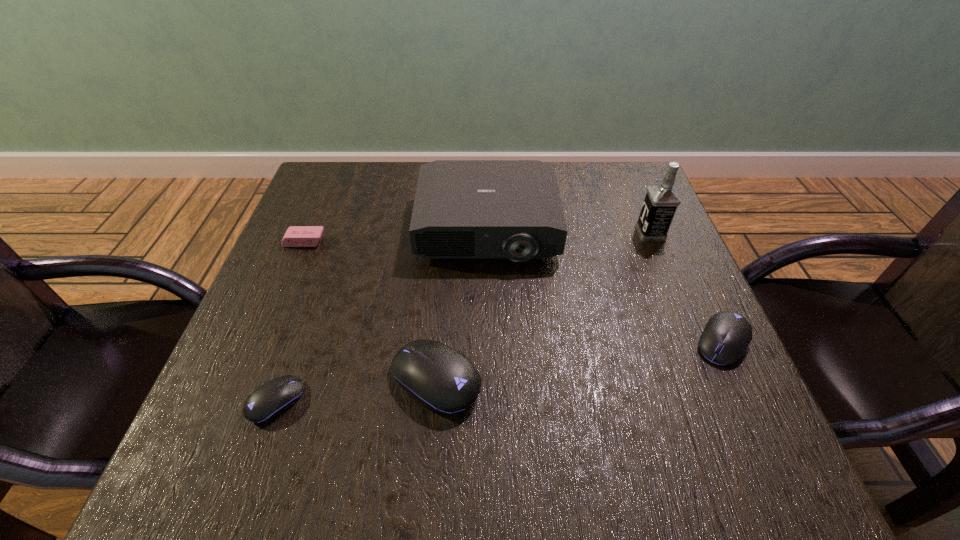
Find the location of a particular element. The width and height of the screenshot is (960, 540). the shortest computer mouse is located at coordinates (270, 400).

This screenshot has width=960, height=540. Identify the location of the second computer mouse from right to left. (441, 378).

Find the location of `the fourth shortest object`. the fourth shortest object is located at coordinates (441, 378).

Locate an element on the screen. Image resolution: width=960 pixels, height=540 pixels. the rightmost computer mouse is located at coordinates (726, 336).

Where is `the second shortest computer mouse`? This screenshot has width=960, height=540. the second shortest computer mouse is located at coordinates (726, 336).

Find the location of a particular element. the fifth shortest object is located at coordinates (512, 209).

Find the location of a particular element. vodka is located at coordinates (661, 201).

In order to click on eraser in this screenshot , I will do `click(296, 236)`.

You are a GUI agent. You are given a task and a screenshot of the screen. Output one action in this format:
    pyautogui.click(x=<x>, y=<y>)
    Task: Click on the free space located 0.350m on the right of the leftmost computer mouse
    The image size is (960, 540).
    Given the screenshot: What is the action you would take?
    pyautogui.click(x=511, y=401)

I want to click on vacant space located 0.230m on the back of the tallest computer mouse, so click(x=445, y=259).